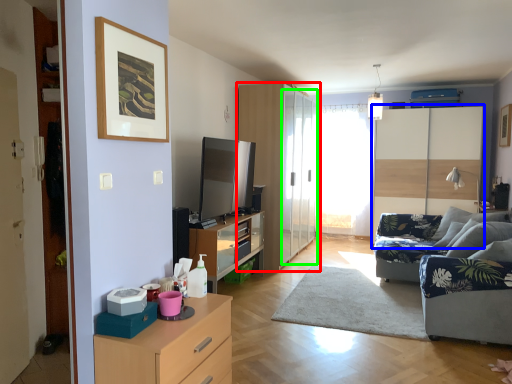
Question: Which object is the farthest from cupboard (highlighted by a red box)? Choose among these: dresser (highlighted by a blue box) or glass door (highlighted by a green box).

Choices:
 (A) dresser
 (B) glass door

Answer: (A)